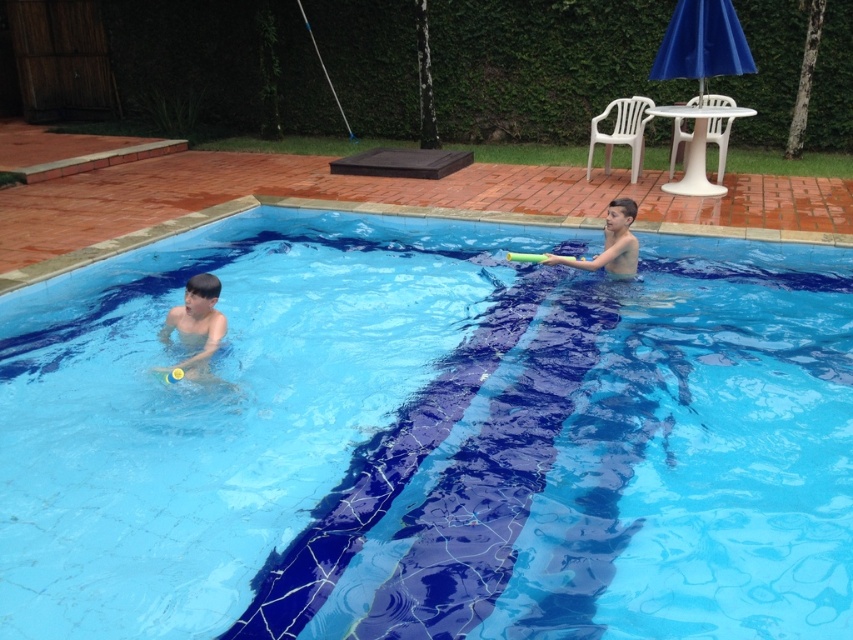
You are a photographer taking a picture of the matte black boy at left and the smooth yellow toy at upper right. Which object will appear smaller in the photo?

The matte black boy at left will appear smaller in the photo because it has a lesser width compared to the smooth yellow toy at upper right.

You are a lifeguard standing at the edge of the pool and you see two points in the pool area. Which point is closer to you, point (614, 298) or point (167, 323)?

Point (614, 298) is further to the viewer than point (167, 323), so the closer point to you is point (167, 323).